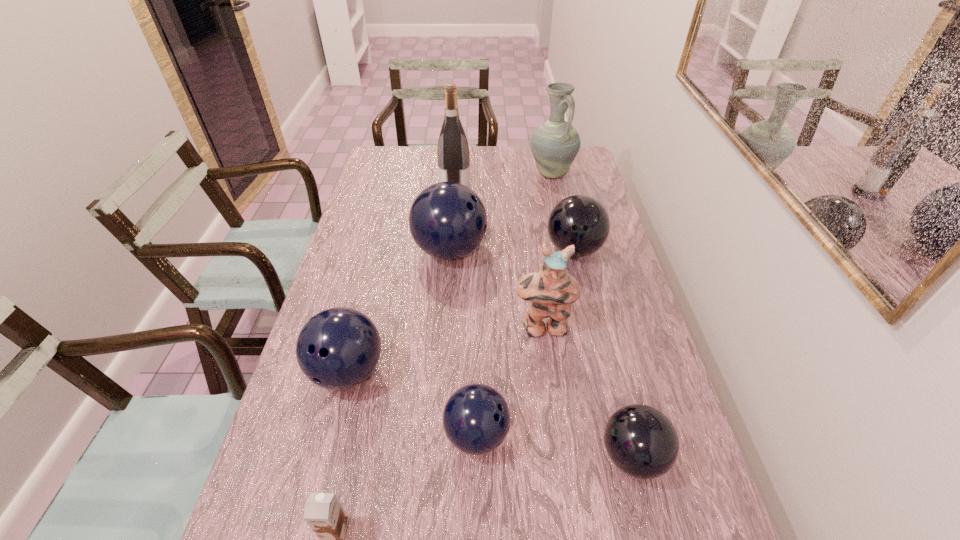
Identify the location of the nearer black bowling ball. The image size is (960, 540). (641, 441).

I want to click on free space located 0.070m on the label of the wine bottle, so click(489, 192).

Find the location of a particular element. This screenshot has width=960, height=540. free space located 0.180m on the handle side of the pitcher is located at coordinates (561, 213).

The height and width of the screenshot is (540, 960). Identify the location of free space located 0.120m on the front-facing side of the figurine. (549, 380).

Where is `vacant space located on the surface of the farthest blue bowling ball near the finger holes`? The height and width of the screenshot is (540, 960). vacant space located on the surface of the farthest blue bowling ball near the finger holes is located at coordinates [x=573, y=251].

I want to click on vacant position located 0.250m on the side of the farther black bowling ball with the finger holes, so click(x=593, y=333).

Find the location of `free space located on the surface of the leftmost blue bowling ball near the finger holes`. free space located on the surface of the leftmost blue bowling ball near the finger holes is located at coordinates (311, 517).

The height and width of the screenshot is (540, 960). Identify the location of vacant region located 0.130m on the surface of the smallest blue bowling ball near the finger holes. point(567,435).

The image size is (960, 540). Identify the location of blank space located 0.330m on the side of the nearer black bowling ball with the finger holes. (445, 456).

Identify the location of vacant space situated on the side of the nearer black bowling ball with the finger holes. The image size is (960, 540). (571, 456).